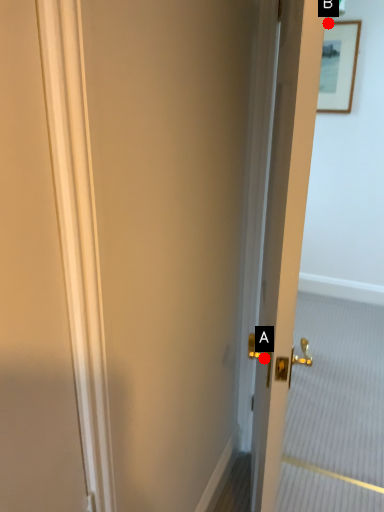
Question: Two points are circled on the image, labeled by A and B beside each circle. Among these points, which one is nearest to the camera?

Choices:
 (A) A is closer
 (B) B is closer

Answer: (A)